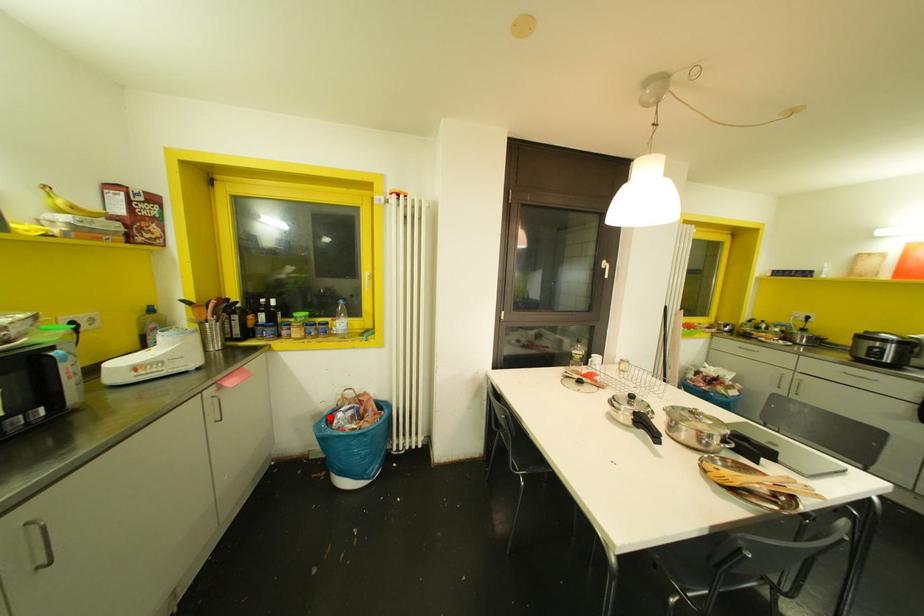
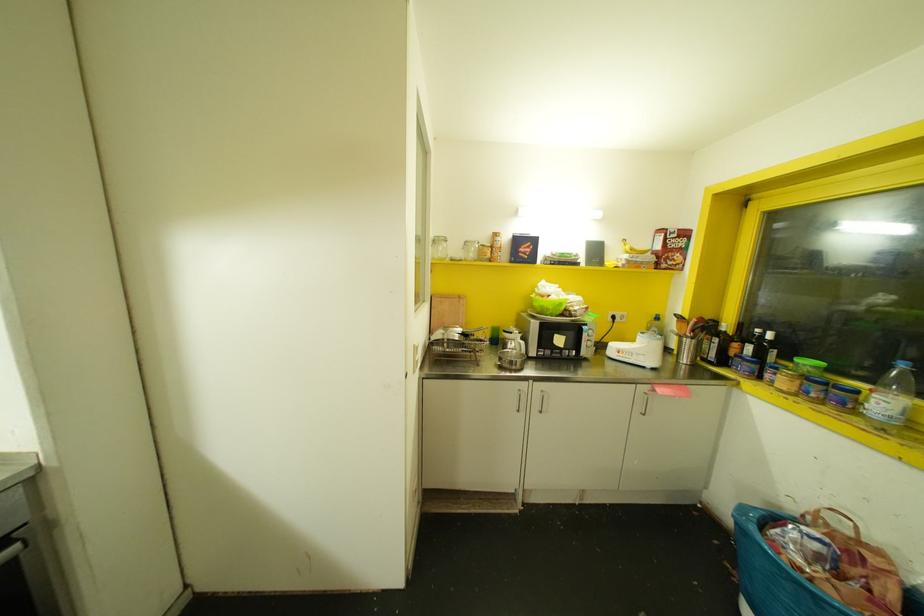
Question: I am providing you with two images of the same scene from different viewpoints. A red point is shown in image1. For the corresponding object point in image2, is it positioned nearer or farther from the camera?

Choices:
 (A) Nearer
 (B) Farther

Answer: (A)